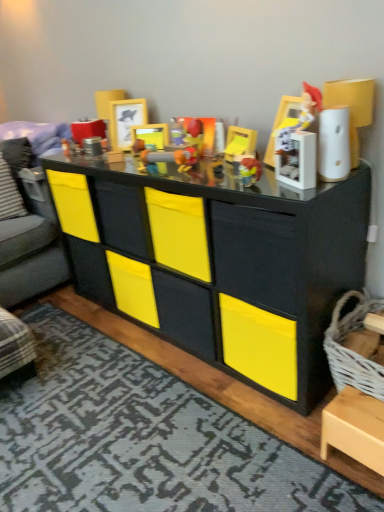
Question: Is matte plastic toy at center, placed as the third toy when sorted from right to left, taller than wooden picture frame at upper center, acting as the 2th picture frame starting from the front?

Choices:
 (A) yes
 (B) no

Answer: (B)

Question: Is matte plastic toy at center, placed as the third toy when sorted from right to left, not close to wooden picture frame at upper center, the first picture frame when ordered from back to front?

Choices:
 (A) yes
 (B) no

Answer: (B)

Question: Considering the relative sizes of matte plastic toy at center, which ranks as the third toy in left-to-right order, and wooden picture frame at upper center, acting as the 2th picture frame starting from the front, in the image provided, is matte plastic toy at center, which ranks as the third toy in left-to-right order, wider than wooden picture frame at upper center, acting as the 2th picture frame starting from the front,?

Choices:
 (A) yes
 (B) no

Answer: (B)

Question: Is matte plastic toy at center, which ranks as the third toy in left-to-right order, closer to the viewer compared to wooden picture frame at upper center, the first picture frame when ordered from back to front?

Choices:
 (A) yes
 (B) no

Answer: (A)

Question: From the image's perspective, does matte plastic toy at center, placed as the third toy when sorted from right to left, appear higher than wooden picture frame at upper center, the first picture frame when ordered from back to front?

Choices:
 (A) yes
 (B) no

Answer: (B)

Question: Choose the correct answer: Is matte plastic toy at center, which ranks as the third toy in left-to-right order, inside matte wooden picture frame at center, the first picture frame viewed from the front, or outside it?

Choices:
 (A) inside
 (B) outside

Answer: (B)

Question: Is point (193, 162) closer or farther from the camera than point (152, 142)?

Choices:
 (A) farther
 (B) closer

Answer: (B)

Question: Considering the positions of matte plastic toy at center, placed as the third toy when sorted from right to left, and matte wooden picture frame at center, the first picture frame viewed from the front, in the image, is matte plastic toy at center, placed as the third toy when sorted from right to left, bigger or smaller than matte wooden picture frame at center, the first picture frame viewed from the front,?

Choices:
 (A) big
 (B) small

Answer: (B)

Question: Is matte plastic toy at center, placed as the third toy when sorted from right to left, wider or thinner than matte wooden picture frame at center, the second picture frame positioned from the back?

Choices:
 (A) wide
 (B) thin

Answer: (A)

Question: In the image, is wooden picture frame at upper center, acting as the 2th picture frame starting from the front, positioned in front of or behind matte plastic toy at center, placed as the third toy when sorted from right to left?

Choices:
 (A) behind
 (B) front

Answer: (A)

Question: From a real-world perspective, is wooden picture frame at upper center, the first picture frame when ordered from back to front, physically located above or below matte plastic toy at center, placed as the third toy when sorted from right to left?

Choices:
 (A) below
 (B) above

Answer: (B)

Question: From the image's perspective, is wooden picture frame at upper center, acting as the 2th picture frame starting from the front, positioned above or below matte plastic toy at center, placed as the third toy when sorted from right to left?

Choices:
 (A) above
 (B) below

Answer: (A)

Question: Is point (132, 108) closer or farther from the camera than point (185, 167)?

Choices:
 (A) farther
 (B) closer

Answer: (A)

Question: Is translucent plastic toy at center, acting as the 4th toy starting from the left, bigger or smaller than black matte chest of drawers at center?

Choices:
 (A) small
 (B) big

Answer: (A)

Question: From the image's perspective, is translucent plastic toy at center, arranged as the 2th toy when viewed from the right, located above or below black matte chest of drawers at center?

Choices:
 (A) below
 (B) above

Answer: (B)